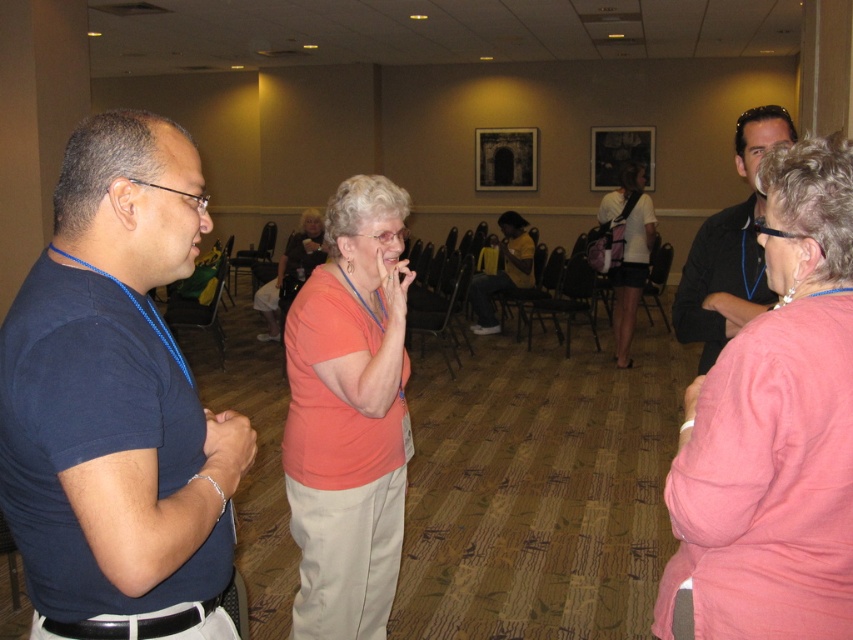
Question: Which object is positioned closest to the dark blue t-shirt at left?

Choices:
 (A) pink fabric shirt at center
 (B) black matte shirt at right
 (C) pink fabric backpack at center

Answer: (A)

Question: Is dark blue t-shirt at left positioned in front of pink fabric backpack at center?

Choices:
 (A) no
 (B) yes

Answer: (B)

Question: Can you confirm if pink fabric shirt at center is wider than pink fabric backpack at center?

Choices:
 (A) no
 (B) yes

Answer: (A)

Question: Which point is closer to the camera?

Choices:
 (A) (753, 218)
 (B) (323, 435)
 (C) (126, 352)

Answer: (C)

Question: Does pink fabric shirt at center come behind black matte shirt at right?

Choices:
 (A) no
 (B) yes

Answer: (A)

Question: Based on their relative distances, which object is nearer to the pink fabric shirt at center?

Choices:
 (A) black matte shirt at right
 (B) orange matte shirt at center
 (C) dark blue t-shirt at left

Answer: (A)